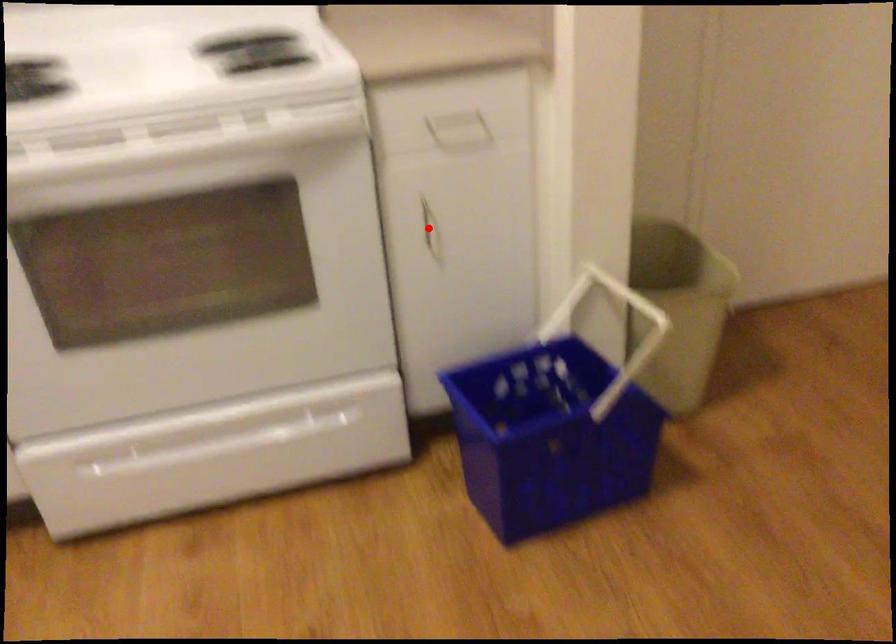
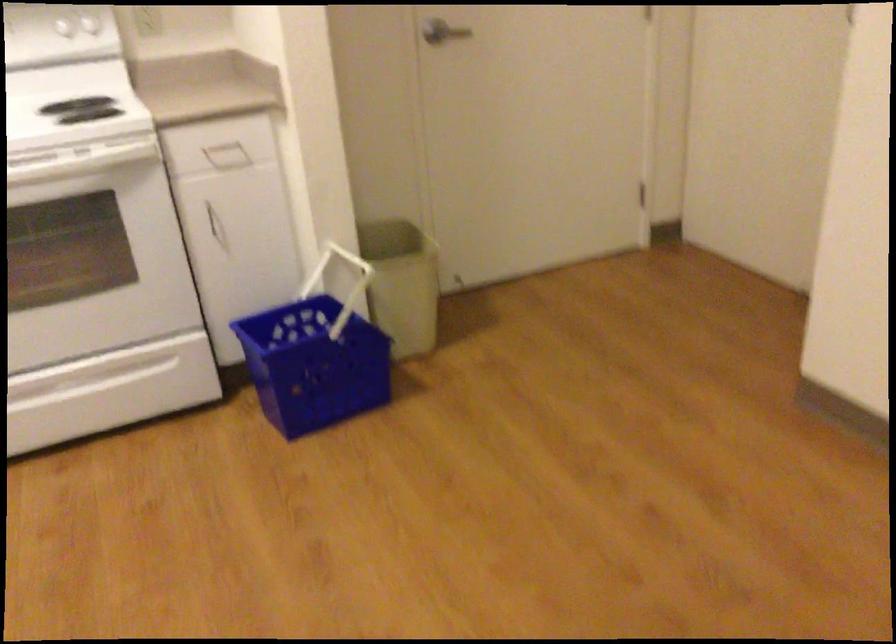
Question: I am providing you with two images of the same scene from different viewpoints. Given a red point in image1, look at the same physical point in image2. Is it:

Choices:
 (A) Closer to the viewpoint
 (B) Farther from the viewpoint

Answer: (B)